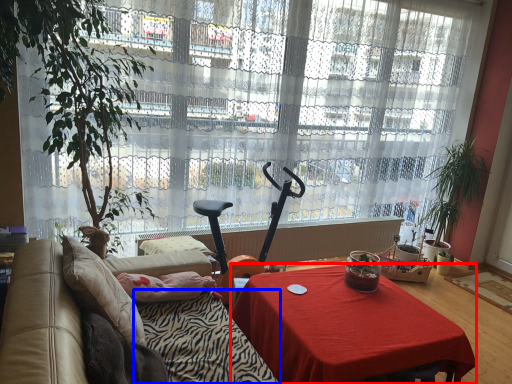
Question: Which point is further to the camera, desk (highlighted by a red box) or blanket (highlighted by a blue box)?

Choices:
 (A) desk
 (B) blanket

Answer: (A)